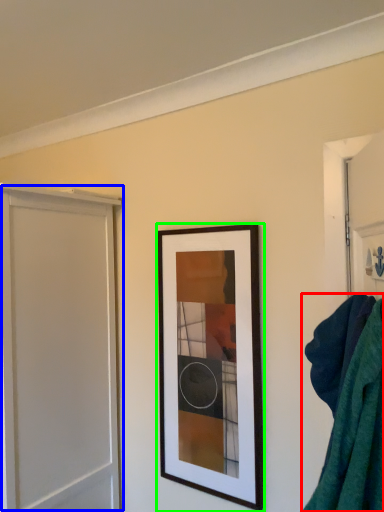
Question: Which is nearer to the bath towel (highlighted by a red box)? screen door (highlighted by a blue box) or picture frame (highlighted by a green box).

Choices:
 (A) screen door
 (B) picture frame

Answer: (B)